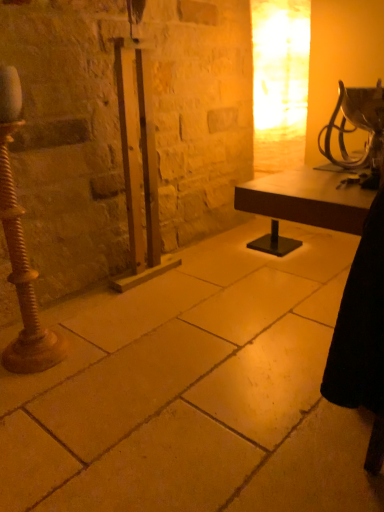
Describe the element at coordinates (21, 249) in the screenshot. The width and height of the screenshot is (384, 512). I see `rusty metal pole at left` at that location.

What is the approximate width of smooth stone floor at center?

1.86 meters.

Locate an element on the screen. The image size is (384, 512). rusty metal pole at left is located at coordinates (21, 249).

From a real-world perspective, is smooth stone floor at center below metallic silver table lamp at upper right?

Indeed, from a real-world perspective, smooth stone floor at center is positioned beneath metallic silver table lamp at upper right.

Can you confirm if smooth stone floor at center is thinner than metallic silver table lamp at upper right?

Incorrect, the width of smooth stone floor at center is not less than that of metallic silver table lamp at upper right.

The height and width of the screenshot is (512, 384). What are the coordinates of `concrete on the left of metallic silver table lamp at upper right` in the screenshot? It's located at (194, 392).

Is smooth stone floor at center oriented away from metallic silver table lamp at upper right?

No.

Considering the positions of objects rusty metal pole at left and smooth stone floor at center in the image provided, who is more to the left, rusty metal pole at left or smooth stone floor at center?

rusty metal pole at left is more to the left.

Looking at this image, is rusty metal pole at left turned away from smooth stone floor at center?

No.

From the image's perspective, is rusty metal pole at left above or below smooth stone floor at center?

From the image's perspective, rusty metal pole at left appears above smooth stone floor at center.

Is rusty metal pole at left positioned far away from smooth stone floor at center?

That's not correct — rusty metal pole at left is a little close to smooth stone floor at center.

Is smooth stone floor at center far away from rusty metal pole at left?

Actually, smooth stone floor at center and rusty metal pole at left are a little close together.

Find the location of a particular element. Image resolution: width=384 pixels, height=512 pixels. pillar above the smooth stone floor at center (from a real-world perspective) is located at coordinates (21, 249).

Which object is thinner, smooth stone floor at center or rusty metal pole at left?

Thinner between the two is rusty metal pole at left.

Is smooth stone floor at center taller than rusty metal pole at left?

No, smooth stone floor at center is not taller than rusty metal pole at left.

Is rusty metal pole at left looking in the opposite direction of metallic silver table lamp at upper right?

No, rusty metal pole at left's orientation is not away from metallic silver table lamp at upper right.

From the image's perspective, which one is positioned lower, rusty metal pole at left or metallic silver table lamp at upper right?

rusty metal pole at left is shown below in the image.

Does rusty metal pole at left lie behind metallic silver table lamp at upper right?

Yes, rusty metal pole at left is further from the camera.

Is metallic silver table lamp at upper right facing towards rusty metal pole at left?

No.

How many degrees apart are the facing directions of metallic silver table lamp at upper right and rusty metal pole at left?

0.00381 degrees.

Is metallic silver table lamp at upper right behind rusty metal pole at left?

No, the depth of metallic silver table lamp at upper right is less than that of rusty metal pole at left.

Is metallic silver table lamp at upper right taller than rusty metal pole at left?

No.

From the picture: Is metallic silver table lamp at upper right completely or partially outside of smooth stone floor at center?

That's correct, metallic silver table lamp at upper right is outside of smooth stone floor at center.

The image size is (384, 512). What are the coordinates of `table lamp that is on the right side of smooth stone floor at center` in the screenshot? It's located at (358, 128).

Does point (360, 162) come farther from viewer compared to point (108, 509)?

Yes.

How many degrees apart are the facing directions of metallic silver table lamp at upper right and smooth stone floor at center?

The angular difference between metallic silver table lamp at upper right and smooth stone floor at center is 178 degrees.

Locate an element on the screen. concrete below the metallic silver table lamp at upper right (from a real-world perspective) is located at coordinates (194, 392).

This screenshot has height=512, width=384. Identify the location of concrete on the right of rusty metal pole at left. (194, 392).

Based on their spatial positions, is rusty metal pole at left or metallic silver table lamp at upper right further from smooth stone floor at center?

metallic silver table lamp at upper right is further to smooth stone floor at center.

From the image, which object appears to be farther from rusty metal pole at left, metallic silver table lamp at upper right or smooth stone floor at center?

The object further to rusty metal pole at left is metallic silver table lamp at upper right.

Estimate the real-world distances between objects in this image. Which object is closer to rusty metal pole at left, smooth stone floor at center or metallic silver table lamp at upper right?

smooth stone floor at center is closer to rusty metal pole at left.

Considering their positions, is rusty metal pole at left positioned further to metallic silver table lamp at upper right than smooth stone floor at center?

rusty metal pole at left is positioned further to the anchor metallic silver table lamp at upper right.

Considering their positions, is smooth stone floor at center positioned closer to metallic silver table lamp at upper right than rusty metal pole at left?

Among the two, smooth stone floor at center is located nearer to metallic silver table lamp at upper right.

Based on their spatial positions, is metallic silver table lamp at upper right or rusty metal pole at left closer to smooth stone floor at center?

rusty metal pole at left.

At what (x,y) coordinates should I click in order to perform the action: click on concrete between rusty metal pole at left and metallic silver table lamp at upper right. Please return your answer as a coordinate pair (x, y). The image size is (384, 512). Looking at the image, I should click on (194, 392).